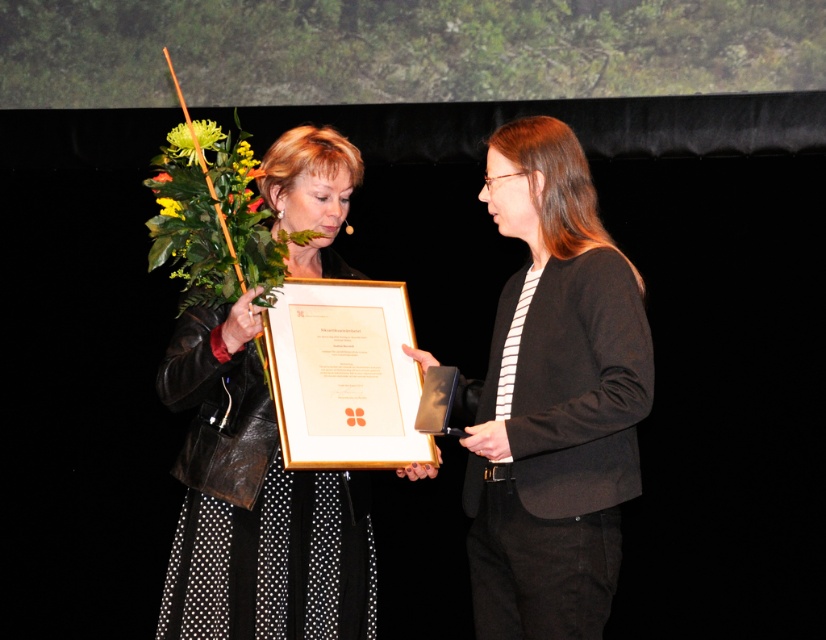
Who is positioned more to the right, leather jacket at center or yellow matte flower at upper left?

Positioned to the right is leather jacket at center.

From the picture: Measure the distance between leather jacket at center and yellow matte flower at upper left.

26.47 inches

At what (x,y) coordinates should I click in order to perform the action: click on leather jacket at center. Please return your answer as a coordinate pair (x, y). Looking at the image, I should click on (255, 502).

Can you confirm if black matte blazer at center is taller than green leafy bouquet at center?

Indeed, black matte blazer at center has a greater height compared to green leafy bouquet at center.

What do you see at coordinates (552, 400) in the screenshot?
I see `black matte blazer at center` at bounding box center [552, 400].

Locate an element on the screen. black matte blazer at center is located at coordinates (552, 400).

Locate an element on the screen. Image resolution: width=826 pixels, height=640 pixels. black matte blazer at center is located at coordinates (552, 400).

Does point (171, 200) lie in front of point (259, 196)?

Yes, it is in front of point (259, 196).

Is green leafy bouquet at upper left above green leafy bouquet at center?

Actually, green leafy bouquet at upper left is below green leafy bouquet at center.

The image size is (826, 640). Find the location of `green leafy bouquet at upper left`. green leafy bouquet at upper left is located at coordinates (169, 205).

Locate an element on the screen. green leafy bouquet at upper left is located at coordinates (169, 205).